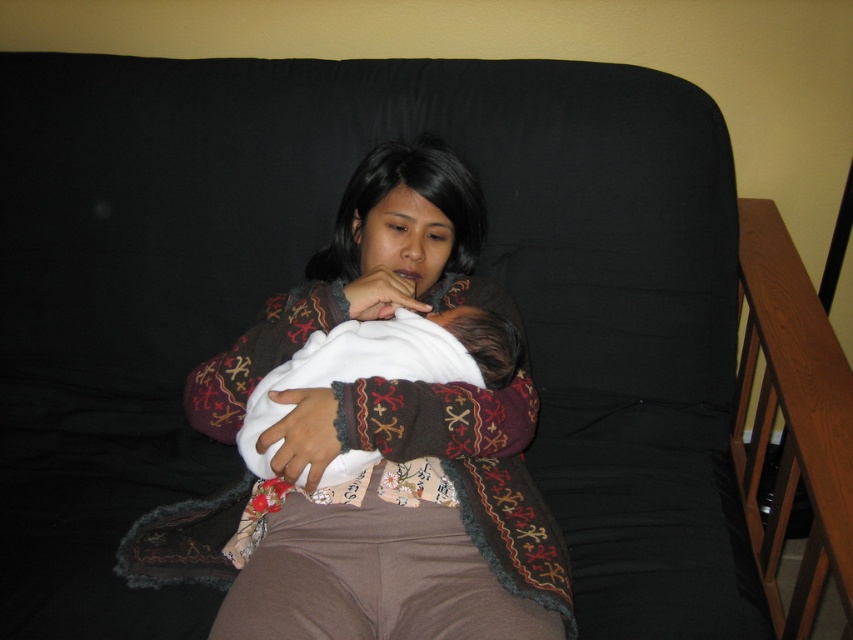
You are a photographer setting up a shoot in this domestic scene. You need to ensure that the brown textured sweater at center and the white soft baby at center are both clearly visible in the frame. Given their sizes, which object should you prioritize positioning closer to the camera to maintain clarity and detail?

The white soft baby at center is smaller than the brown textured sweater at center. To ensure both are clearly visible, prioritize positioning the white soft baby at center closer to the camera since its smaller size might require better focus and detail capture.

You are a photographer trying to capture a closeup shot of the brown textured sweater at center and the white soft baby at center. Since you want both subjects to be in focus, you need to know which one is wider. Which object has a greater width?

The brown textured sweater at center has a greater width than the white soft baby at center.

You are a photographer trying to capture a closeup shot of the white soft baby at center without the brown textured sweater at center blocking the view. Can you adjust your angle to do so?

The brown textured sweater at center is above the white soft baby at center, so if you lower your camera angle slightly, you can position it below the sweater to capture the baby without obstruction.